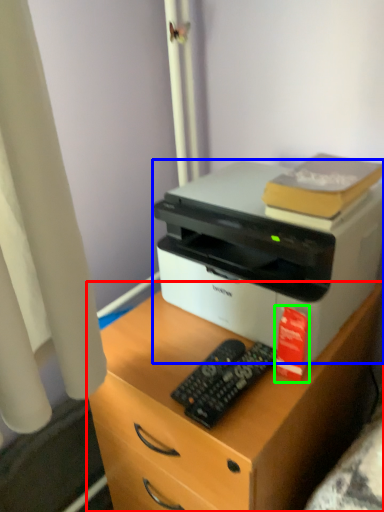
Question: Based on their relative distances, which object is nearer to desk (highlighted by a red box)? Choose from printer (highlighted by a blue box) and book (highlighted by a green box).

Choices:
 (A) printer
 (B) book

Answer: (A)